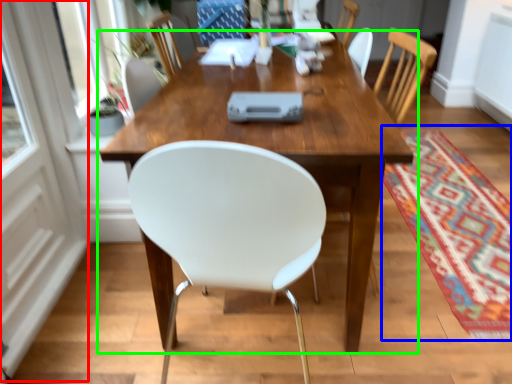
Question: Which object is positioned closest to screen door (highlighted by a red box)? Select from mat (highlighted by a blue box) and table (highlighted by a green box).

Choices:
 (A) mat
 (B) table

Answer: (B)